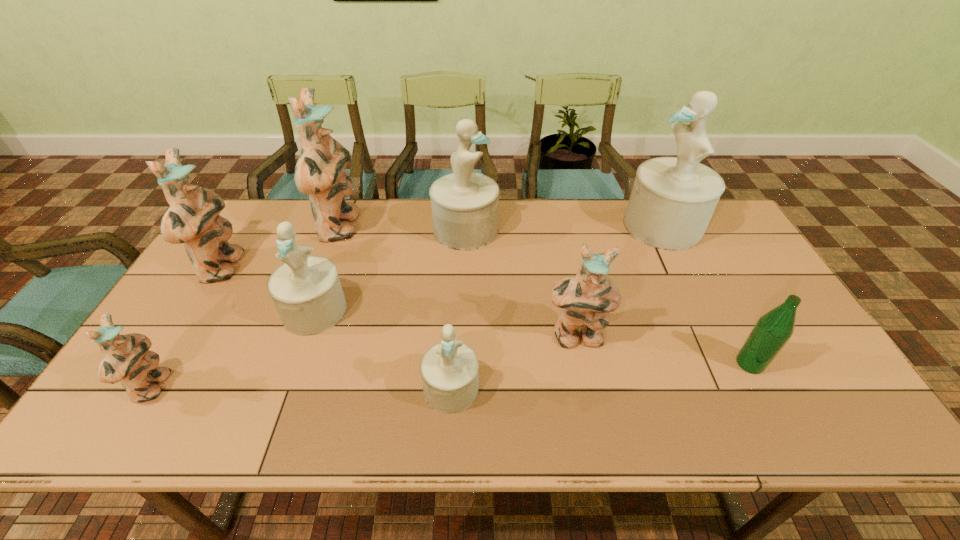
Locate an element on the screen. This screenshot has height=540, width=960. the smallest white figurine is located at coordinates (449, 370).

This screenshot has height=540, width=960. I want to click on the nearest pink figurine, so (x=127, y=359).

Where is `vacant space located 0.200m at the beak of the biggest white figurine`? The width and height of the screenshot is (960, 540). vacant space located 0.200m at the beak of the biggest white figurine is located at coordinates (564, 226).

At what (x,y) coordinates should I click in order to perform the action: click on vacant space located at the beak of the biggest white figurine. Please return your answer as a coordinate pair (x, y). The height and width of the screenshot is (540, 960). Looking at the image, I should click on (532, 226).

Locate an element on the screen. The image size is (960, 540). vacant space located 0.260m at the beak of the biggest white figurine is located at coordinates (546, 226).

I want to click on free location located on the front-facing side of the third pink figurine from left to right, so click(x=382, y=227).

Identify the location of vacant space located at the beak of the third smallest white figurine. This screenshot has width=960, height=540. (543, 230).

Locate an element on the screen. This screenshot has width=960, height=540. free spot located on the front-facing side of the second biggest pink figurine is located at coordinates (352, 268).

Where is `vacant space located at the beak of the leftmost white figurine`? This screenshot has width=960, height=540. vacant space located at the beak of the leftmost white figurine is located at coordinates (282, 402).

Where is `vacant space located on the front-facing side of the third object from right to left`? This screenshot has height=540, width=960. vacant space located on the front-facing side of the third object from right to left is located at coordinates (592, 423).